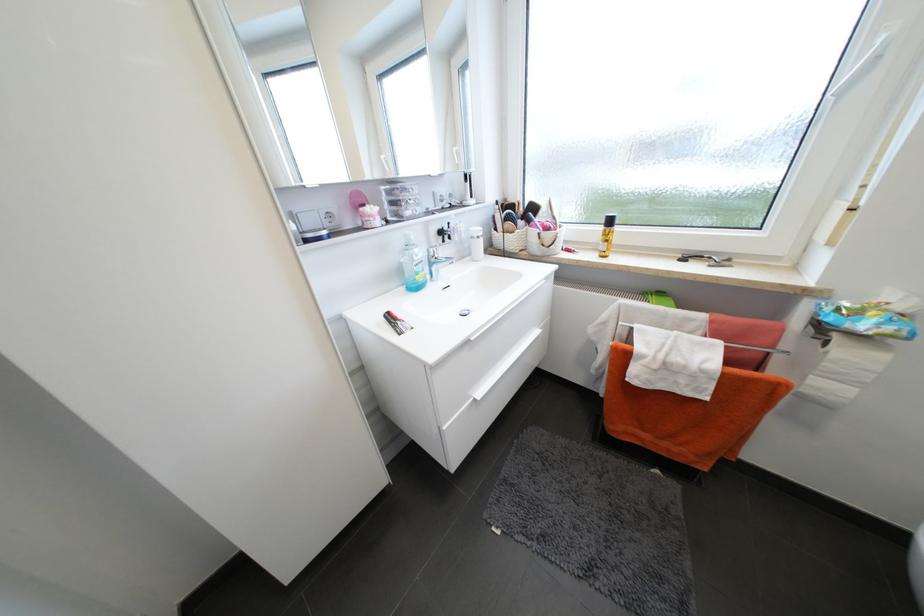
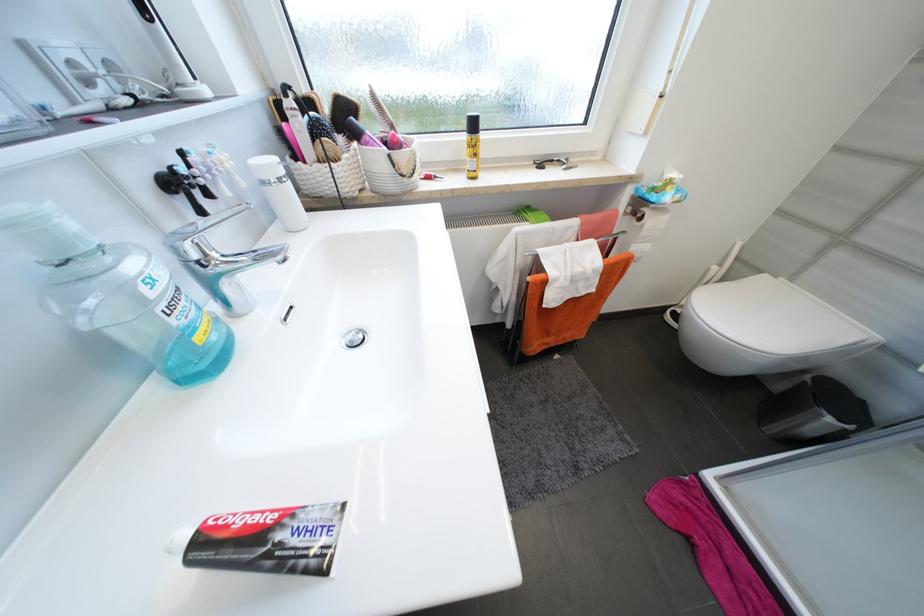
In the second image, find the point that corresponds to [502,230] in the first image.

(304, 158)